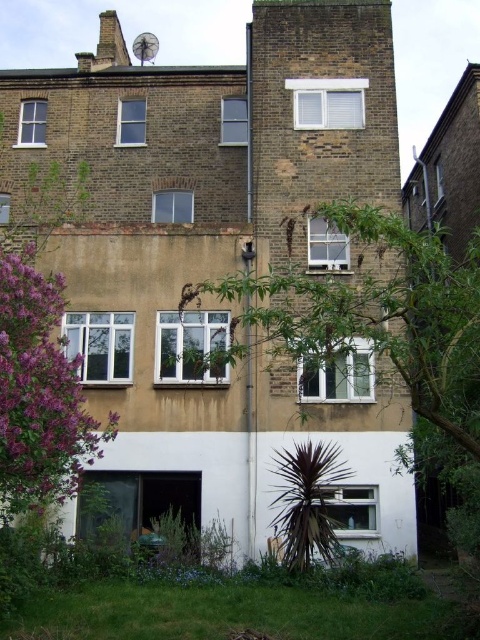
Question: Does green leafy tree at center have a smaller size compared to purple leafy tree at lower left?

Choices:
 (A) no
 (B) yes

Answer: (A)

Question: Does green leafy tree at center have a smaller size compared to purple leafy tree at lower left?

Choices:
 (A) no
 (B) yes

Answer: (A)

Question: Which point is farther from the camera taking this photo?

Choices:
 (A) (83, 436)
 (B) (410, 349)

Answer: (A)

Question: Which point is farther to the camera?

Choices:
 (A) purple leafy tree at lower left
 (B) green leafy tree at center

Answer: (A)

Question: Which point is farther from the camera taking this photo?

Choices:
 (A) (34, 432)
 (B) (447, 352)

Answer: (A)

Question: Is green leafy tree at center above purple leafy tree at lower left?

Choices:
 (A) yes
 (B) no

Answer: (A)